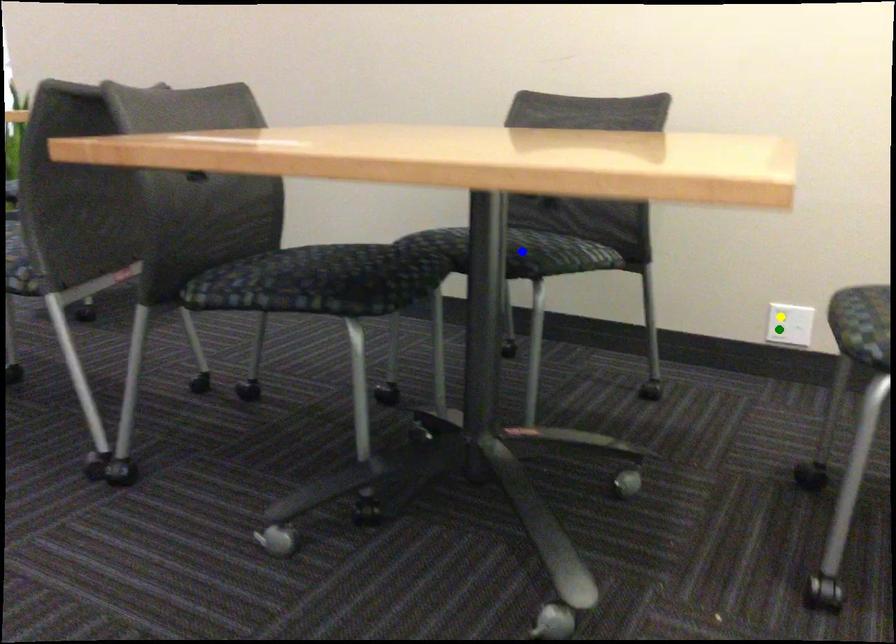
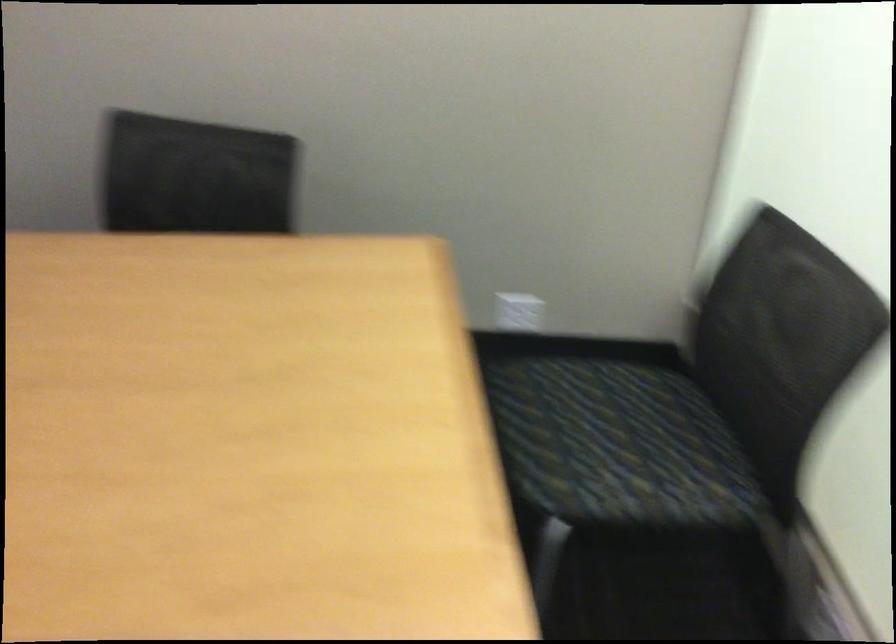
I am providing you with two images of the same scene from different viewpoints. Three points are marked in image1. Which point corresponds to a part or object that is occluded in image2?In image1, three points are marked. Which of them correspond to a part or object that is occluded in image2?Among the three points shown in image1, which one corresponds to a part or object that is no longer visible due to occlusion in image2?

yellow point, green point, blue point